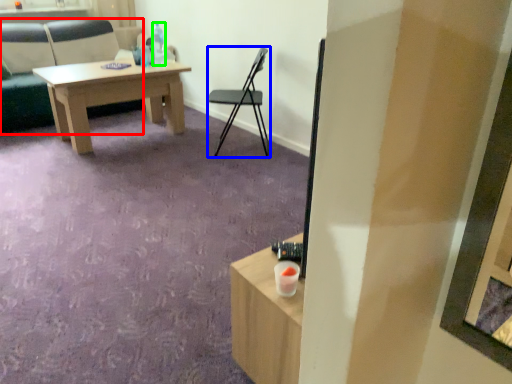
Question: Which object is positioned farthest from chair (highlighted by a red box)? Select from chair (highlighted by a blue box) and bottle (highlighted by a green box).

Choices:
 (A) chair
 (B) bottle

Answer: (A)